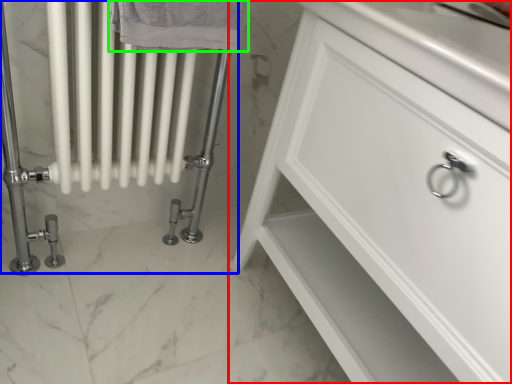
Question: Considering the real-world distances, which object is farthest from bathroom cabinet (highlighted by a red box)? bath (highlighted by a blue box) or bath towel (highlighted by a green box)?

Choices:
 (A) bath
 (B) bath towel

Answer: (B)